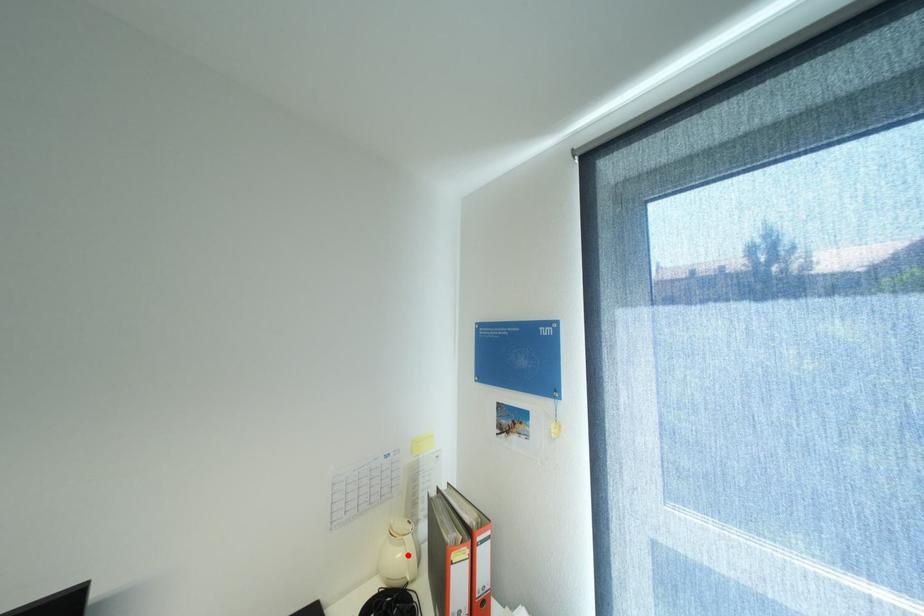
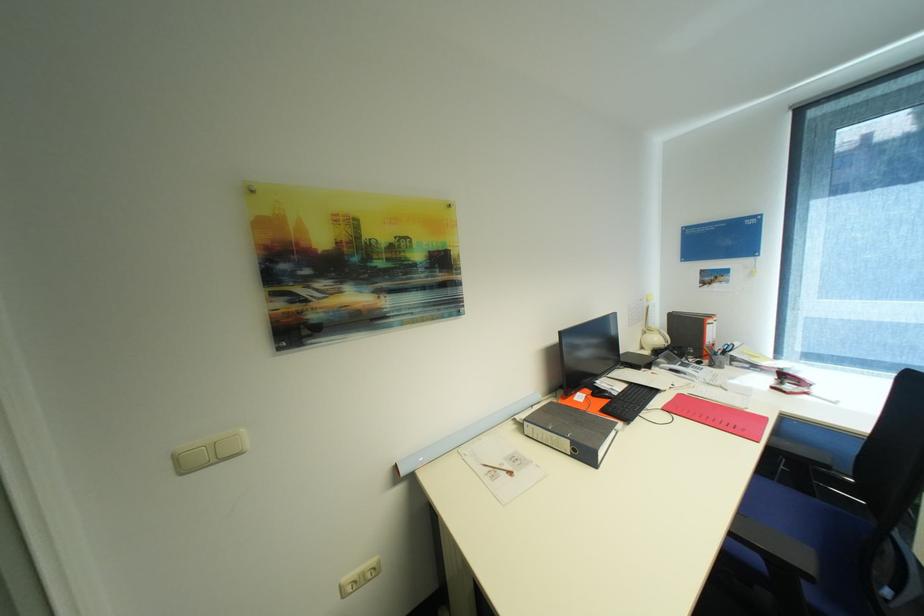
Find the pixel in the second image that matches the highlighted location in the first image.

(663, 339)